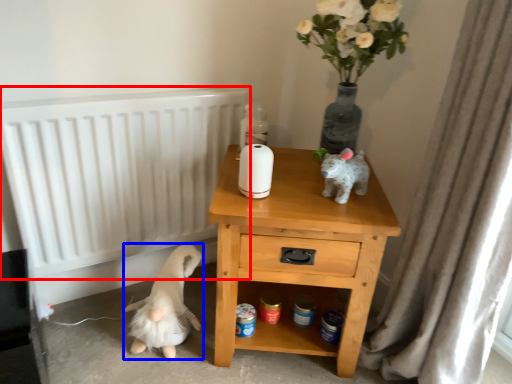
Question: Which point is closer to the camera, radiator (highlighted by a red box) or animal (highlighted by a blue box)?

Choices:
 (A) radiator
 (B) animal

Answer: (A)